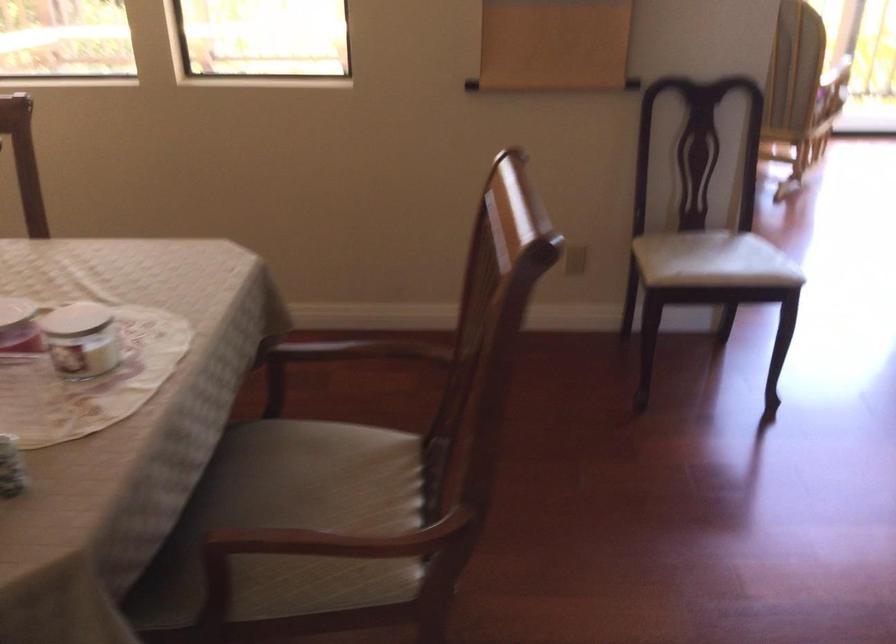
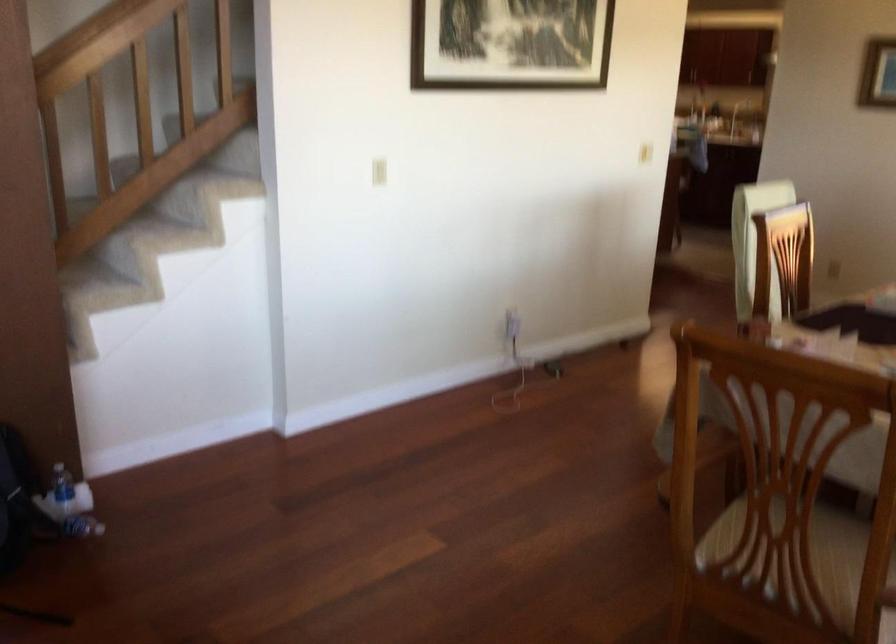
The point at (358, 540) is marked in the first image. Where is the corresponding point in the second image?

(736, 532)